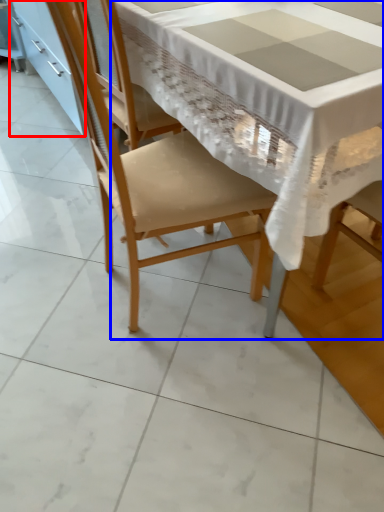
Question: Which point is closer to the camera, cabinetry (highlighted by a red box) or table (highlighted by a blue box)?

Choices:
 (A) cabinetry
 (B) table

Answer: (B)